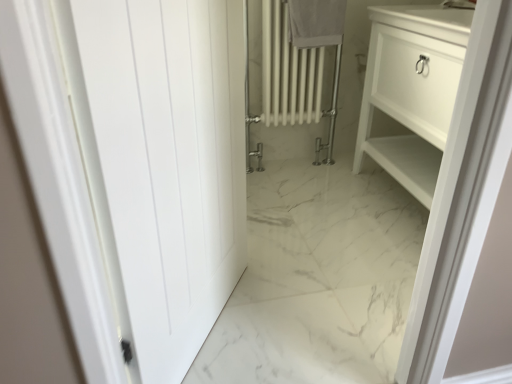
Question: Does white cotton towel at upper center contain white matte door at left?

Choices:
 (A) yes
 (B) no

Answer: (B)

Question: Could you tell me if white cotton towel at upper center is facing white matte door at left?

Choices:
 (A) yes
 (B) no

Answer: (B)

Question: Can you confirm if white cotton towel at upper center is taller than white matte door at left?

Choices:
 (A) no
 (B) yes

Answer: (A)

Question: From the image's perspective, does white cotton towel at upper center appear higher than white matte door at left?

Choices:
 (A) yes
 (B) no

Answer: (A)

Question: Is white cotton towel at upper center located outside white matte door at left?

Choices:
 (A) yes
 (B) no

Answer: (A)

Question: Can you confirm if white cotton towel at upper center is bigger than white matte door at left?

Choices:
 (A) no
 (B) yes

Answer: (A)

Question: From the image's perspective, would you say white matte door at left is shown under white cotton towel at upper center?

Choices:
 (A) yes
 (B) no

Answer: (A)

Question: Does white matte door at left come in front of white cotton towel at upper center?

Choices:
 (A) yes
 (B) no

Answer: (A)

Question: Can you confirm if white matte door at left is bigger than white cotton towel at upper center?

Choices:
 (A) yes
 (B) no

Answer: (A)

Question: Can white cotton towel at upper center be found inside white matte door at left?

Choices:
 (A) no
 (B) yes

Answer: (A)

Question: Does white matte door at left have a lesser height compared to white cotton towel at upper center?

Choices:
 (A) no
 (B) yes

Answer: (A)

Question: Is white matte door at left thinner than white cotton towel at upper center?

Choices:
 (A) yes
 (B) no

Answer: (B)

Question: Is the depth of white cotton towel at upper center greater than that of white glossy cabinet at right?

Choices:
 (A) no
 (B) yes

Answer: (B)